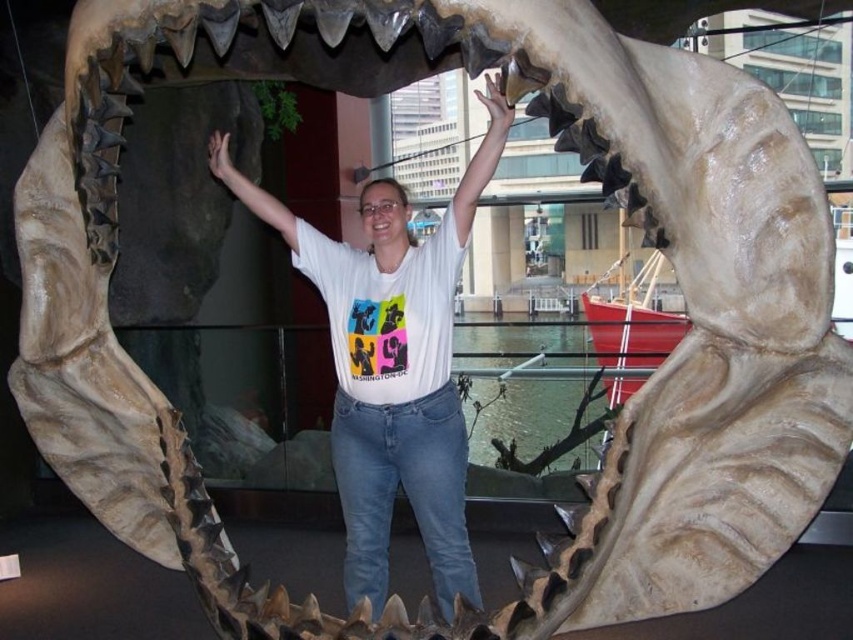
Question: Is white matte t-shirt at center above matte white teeth at center?

Choices:
 (A) yes
 (B) no

Answer: (B)

Question: Does white matte t-shirt at center appear on the left side of matte white teeth at center?

Choices:
 (A) yes
 (B) no

Answer: (B)

Question: Does white matte t-shirt at center have a greater width compared to matte white teeth at center?

Choices:
 (A) yes
 (B) no

Answer: (A)